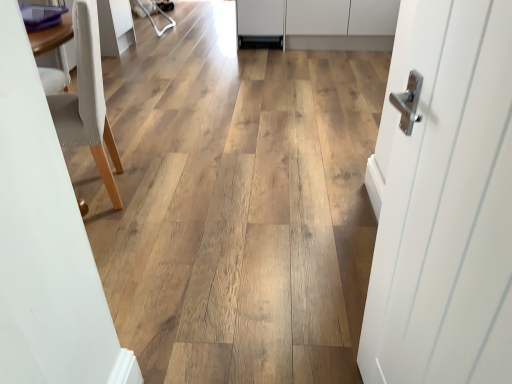
Image resolution: width=512 pixels, height=384 pixels. Find the location of `empty space that is to the right of light beige fabric chair at left`. empty space that is to the right of light beige fabric chair at left is located at coordinates (172, 182).